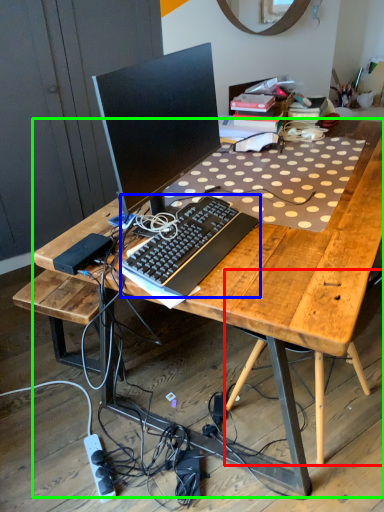
Question: Considering the real-world distances, which object is farthest from computer chair (highlighted by a red box)? computer keyboard (highlighted by a blue box) or desk (highlighted by a green box)?

Choices:
 (A) computer keyboard
 (B) desk

Answer: (A)